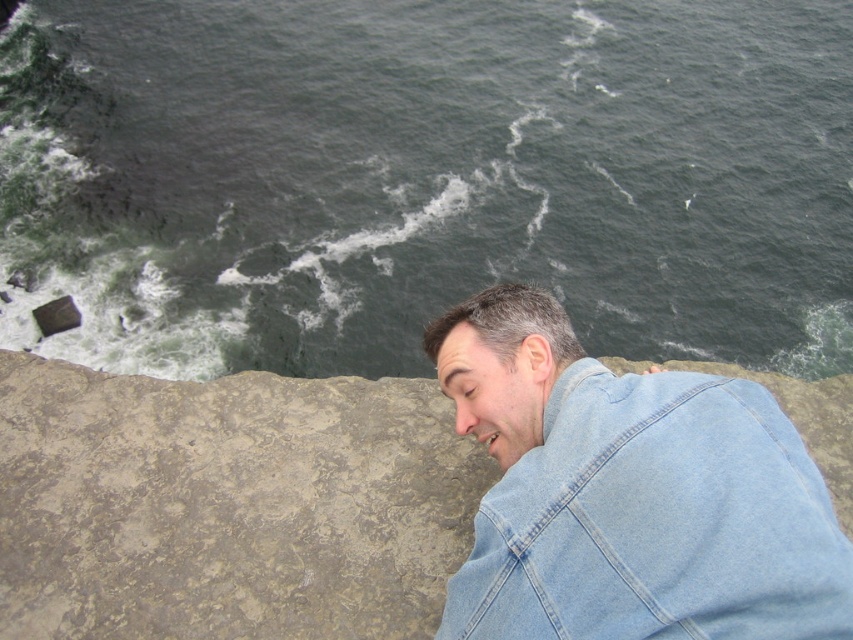
Question: Does dark green water at upper left appear on the left side of gray stone cliff at lower right?

Choices:
 (A) yes
 (B) no

Answer: (B)

Question: Among these points, which one is farthest from the camera?

Choices:
 (A) (x=741, y=268)
 (B) (x=410, y=394)
 (C) (x=631, y=616)

Answer: (A)

Question: Can you confirm if gray stone cliff at lower right is positioned below denim jacket at lower right?

Choices:
 (A) yes
 (B) no

Answer: (A)

Question: Which object is positioned closest to the dark green water at upper left?

Choices:
 (A) gray stone cliff at lower right
 (B) denim jacket at lower right

Answer: (A)

Question: Is dark green water at upper left positioned behind denim jacket at lower right?

Choices:
 (A) yes
 (B) no

Answer: (A)

Question: Which point is closer to the camera?

Choices:
 (A) denim jacket at lower right
 (B) gray stone cliff at lower right
 (C) dark green water at upper left

Answer: (A)